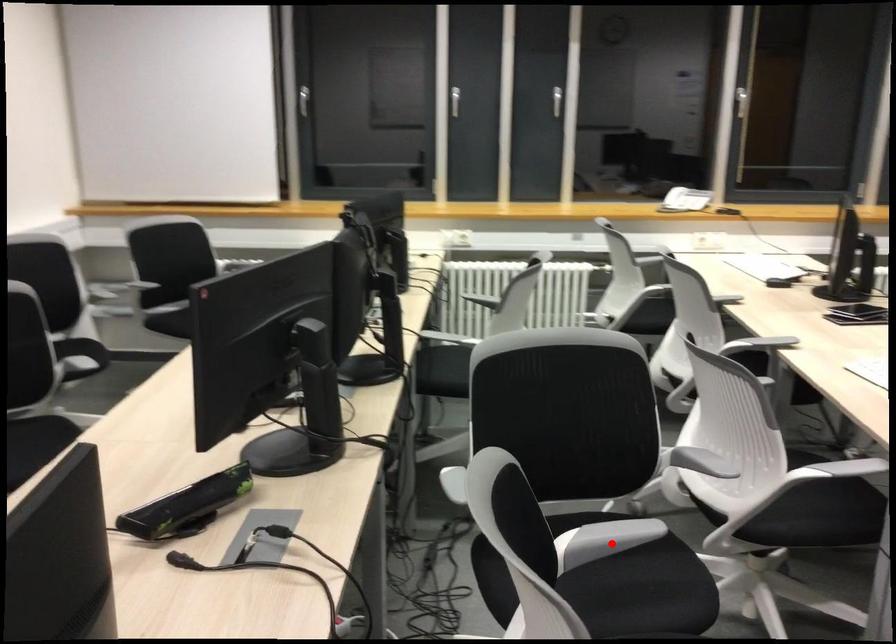
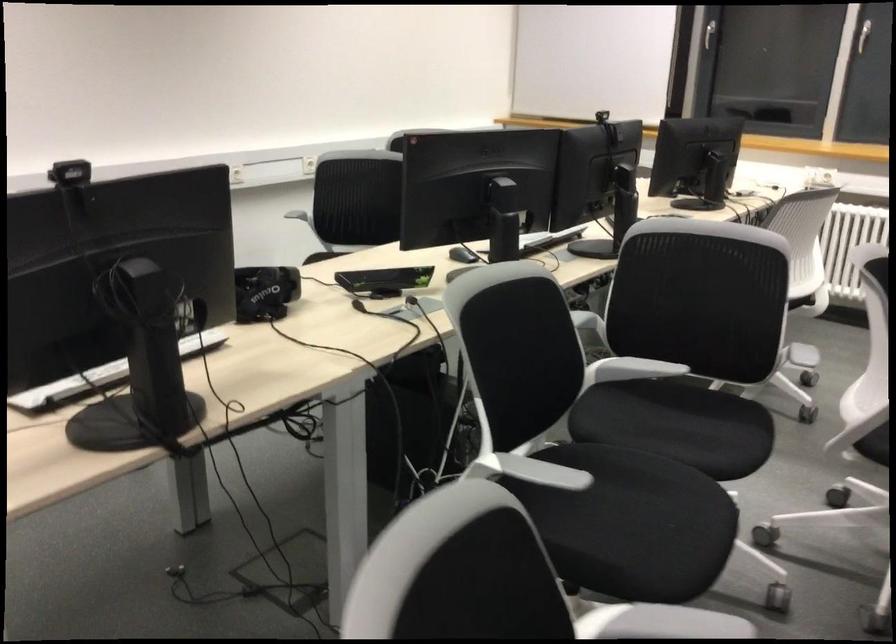
In the second image, find the point that corresponds to the highlighted location in the first image.

(631, 368)